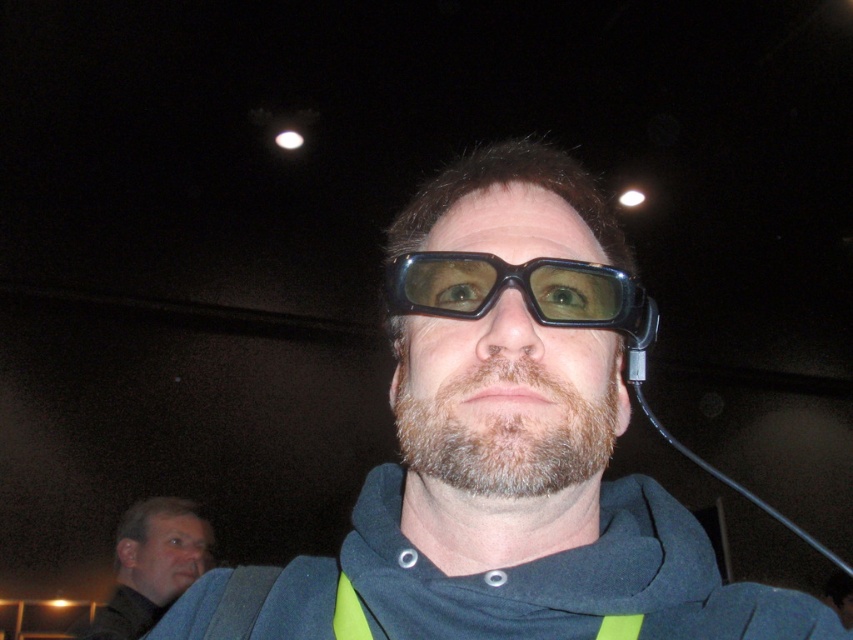
Does brown fuzzy beard at center appear on the left side of matte black glasses at lower left?

No, brown fuzzy beard at center is not to the left of matte black glasses at lower left.

Is brown fuzzy beard at center bigger than matte black glasses at lower left?

Incorrect, brown fuzzy beard at center is not larger than matte black glasses at lower left.

Between point (554, 387) and point (146, 605), which one is positioned in front?

Point (554, 387) is more forward.

At what (x,y) coordinates should I click in order to perform the action: click on brown fuzzy beard at center. Please return your answer as a coordinate pair (x, y). Image resolution: width=853 pixels, height=640 pixels. Looking at the image, I should click on (505, 433).

Can you confirm if black plastic goggles at center is bigger than transparent plastic lens at upper center?

Correct, black plastic goggles at center is larger in size than transparent plastic lens at upper center.

Between point (421, 291) and point (289, 144), which one is positioned in front?

Point (421, 291) is in front.

Does point (442, 266) come closer to viewer compared to point (292, 140)?

Yes, point (442, 266) is in front of point (292, 140).

Where is `black plastic goggles at center`? This screenshot has width=853, height=640. black plastic goggles at center is located at coordinates (521, 291).

Is point (479, 262) farther from camera compared to point (173, 563)?

No, (479, 262) is closer to viewer.

Who is positioned more to the right, black plastic goggles at center or matte black glasses at lower left?

black plastic goggles at center

At what (x,y) coordinates should I click in order to perform the action: click on black plastic goggles at center. Please return your answer as a coordinate pair (x, y). The image size is (853, 640). Looking at the image, I should click on (521, 291).